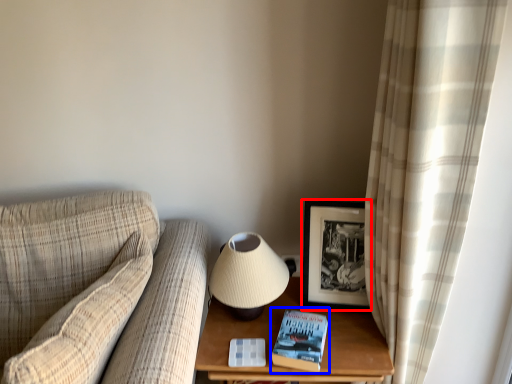
Question: Which point is closer to the camera, picture frame (highlighted by a red box) or paperback book (highlighted by a blue box)?

Choices:
 (A) picture frame
 (B) paperback book

Answer: (B)